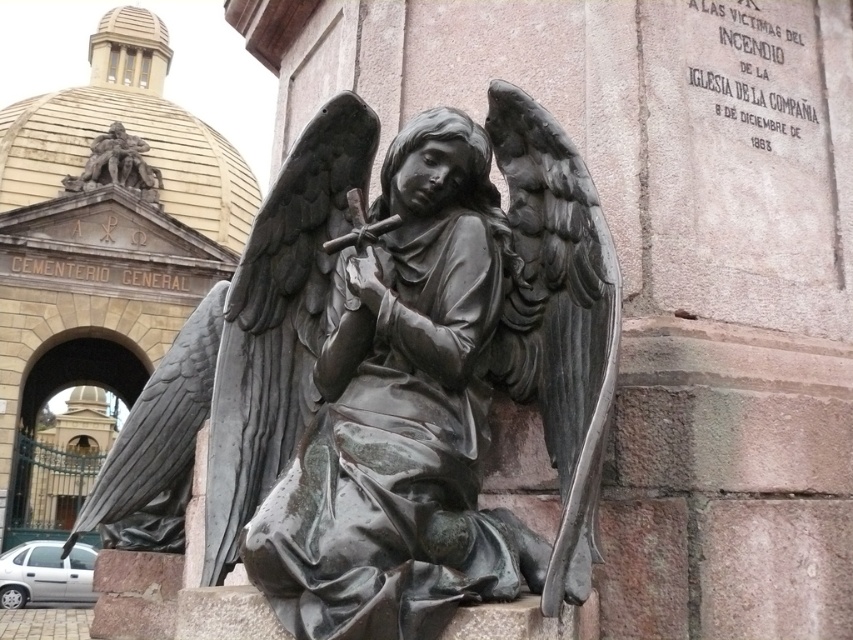
Can you confirm if bronze statue at center is positioned below bronze sculpture at upper left?

Yes, bronze statue at center is below bronze sculpture at upper left.

Consider the image. Is bronze statue at center to the right of bronze sculpture at upper left from the viewer's perspective?

Yes, bronze statue at center is to the right of bronze sculpture at upper left.

Which is in front, point (508, 136) or point (96, 186)?

Point (508, 136) is more forward.

Identify the location of bronze statue at center. (401, 372).